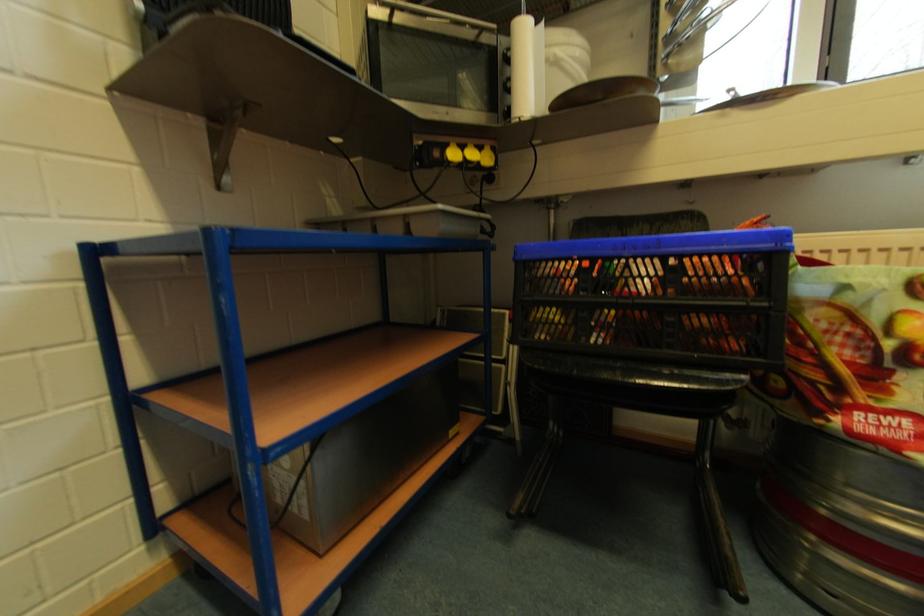
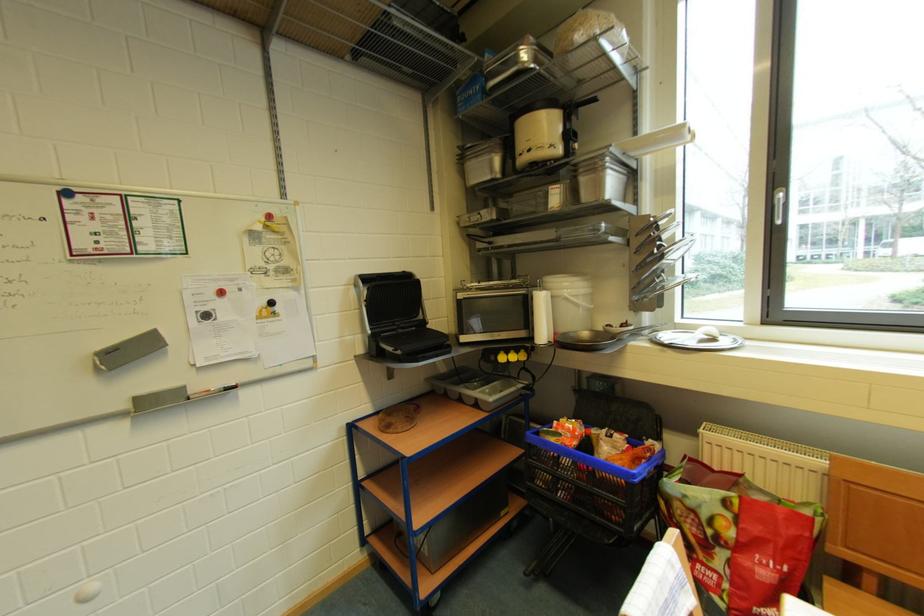
Locate, in the second image, the point that corresponds to pixel 444 156 in the first image.

(500, 361)